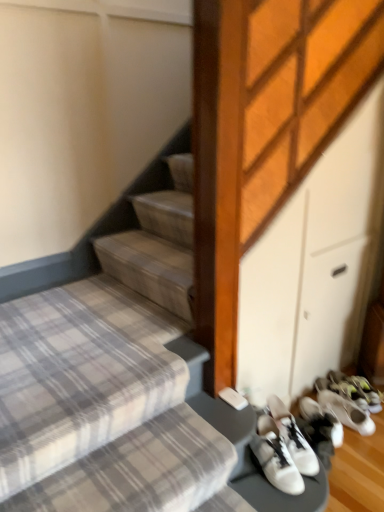
Question: Is plaid fabric stairs at lower left outside of white leather sneakers at lower right, the second footwear viewed from the back?

Choices:
 (A) yes
 (B) no

Answer: (A)

Question: Is plaid fabric stairs at lower left not near white leather sneakers at lower right, which is the 1th footwear from front to back?

Choices:
 (A) no
 (B) yes

Answer: (A)

Question: Can you confirm if plaid fabric stairs at lower left is wider than white leather sneakers at lower right, the second footwear viewed from the back?

Choices:
 (A) no
 (B) yes

Answer: (B)

Question: Is plaid fabric stairs at lower left behind white leather sneakers at lower right, positioned as the 2th footwear in right-to-left order?

Choices:
 (A) no
 (B) yes

Answer: (A)

Question: From the image's perspective, is plaid fabric stairs at lower left located beneath white leather sneakers at lower right, which is the 1th footwear from front to back?

Choices:
 (A) yes
 (B) no

Answer: (B)

Question: From a real-world perspective, does plaid fabric stairs at lower left stand above white leather sneakers at lower right, arranged as the first footwear when viewed from the left?

Choices:
 (A) yes
 (B) no

Answer: (A)

Question: Can you confirm if white matte sneakers at lower right, which is the second footwear from left to right, is smaller than white leather sneakers at lower right, positioned as the 2th footwear in right-to-left order?

Choices:
 (A) no
 (B) yes

Answer: (B)

Question: From a real-world perspective, is white matte sneakers at lower right, arranged as the second footwear when viewed from the front, over white leather sneakers at lower right, arranged as the first footwear when viewed from the left?

Choices:
 (A) yes
 (B) no

Answer: (B)

Question: From a real-world perspective, is white matte sneakers at lower right, positioned as the first footwear in right-to-left order, located beneath white leather sneakers at lower right, positioned as the 2th footwear in right-to-left order?

Choices:
 (A) yes
 (B) no

Answer: (A)

Question: Is white matte sneakers at lower right, arranged as the second footwear when viewed from the front, in contact with white leather sneakers at lower right, positioned as the 2th footwear in right-to-left order?

Choices:
 (A) no
 (B) yes

Answer: (A)

Question: Is white matte sneakers at lower right, arranged as the second footwear when viewed from the front, positioned before white leather sneakers at lower right, the second footwear viewed from the back?

Choices:
 (A) yes
 (B) no

Answer: (B)

Question: Does white matte sneakers at lower right, which is the second footwear from left to right, have a larger size compared to white leather sneakers at lower right, positioned as the 2th footwear in right-to-left order?

Choices:
 (A) yes
 (B) no

Answer: (B)

Question: Is white leather sneakers at lower right, positioned as the 2th footwear in right-to-left order, taller than white matte sneakers at lower right, arranged as the second footwear when viewed from the front?

Choices:
 (A) no
 (B) yes

Answer: (B)